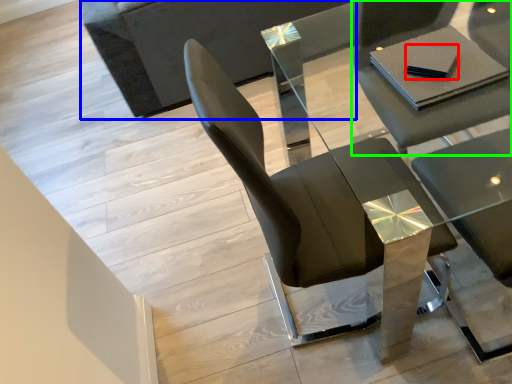
Question: Based on their relative distances, which object is nearer to pad (highlighted by a red box)? Choose from couch (highlighted by a blue box) and chair (highlighted by a green box).

Choices:
 (A) couch
 (B) chair

Answer: (B)